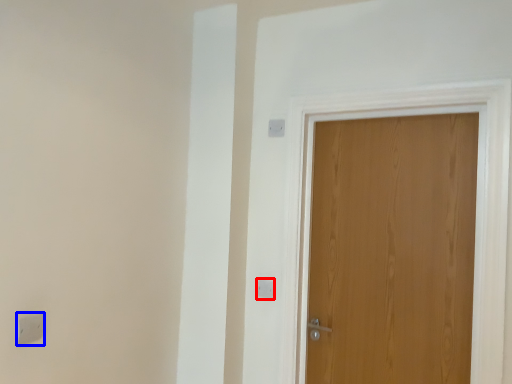
Question: Which object is further to the camera taking this photo, light switch (highlighted by a red box) or light switch (highlighted by a blue box)?

Choices:
 (A) light switch
 (B) light switch

Answer: (A)